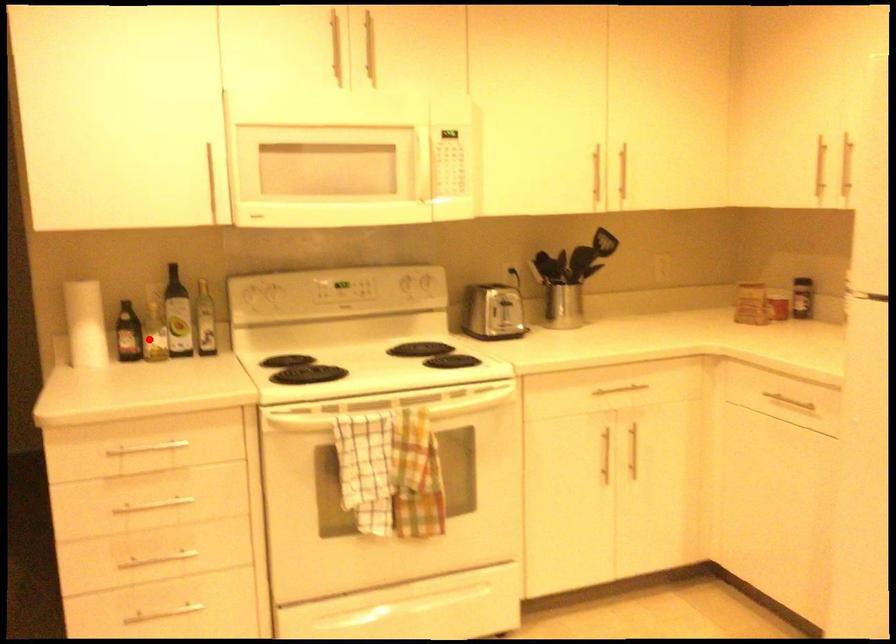
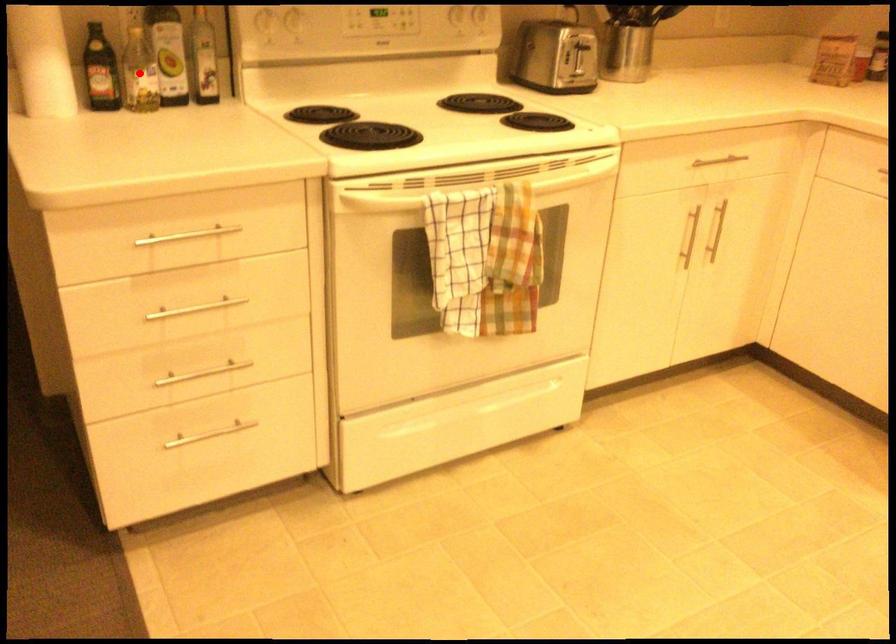
I am providing you with two images of the same scene from different viewpoints. A red point is marked on the first image and another point is marked on the second image. Does the point marked in image1 correspond to the same location as the one in image2?

Yes